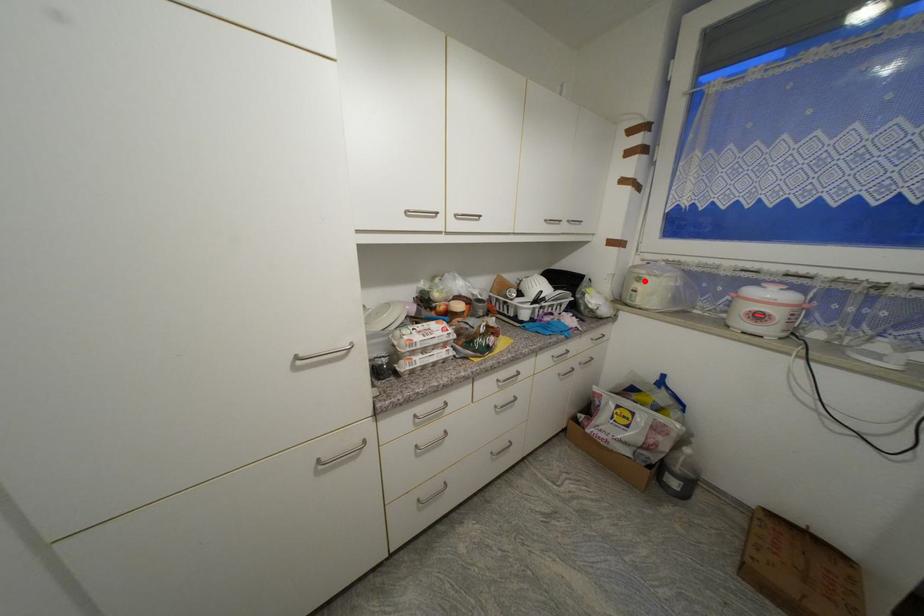
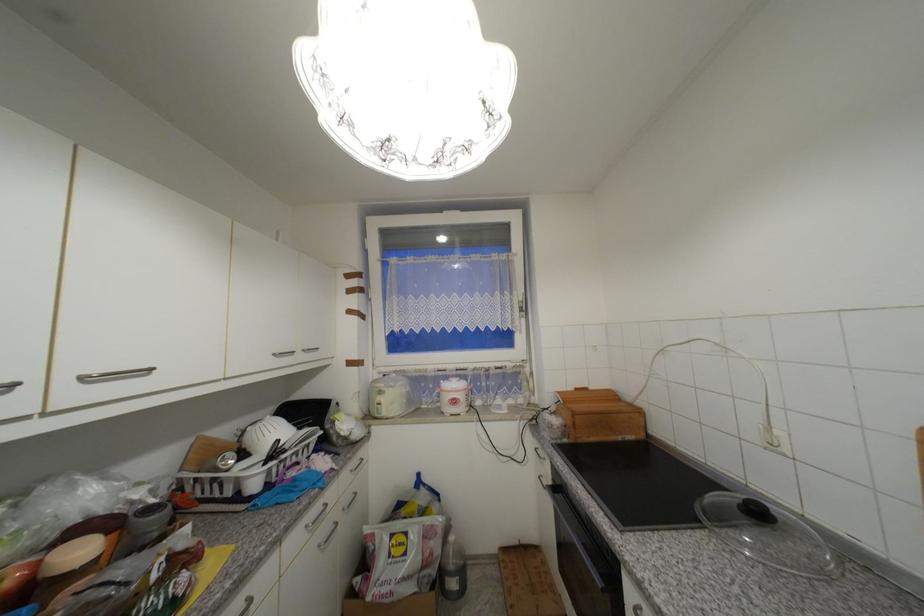
Question: I am providing you with two images of the same scene from different viewpoints. Image1 has a red point marked. In image2, the corresponding 3D location appears at what relative position? Reply with the corresponding letter.

Choices:
 (A) Closer
 (B) Farther

Answer: (B)